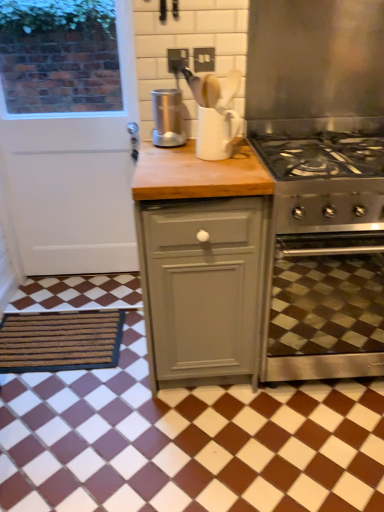
Question: Is brown textured mat at lower left smaller than white matte door at left?

Choices:
 (A) no
 (B) yes

Answer: (B)

Question: Is brown textured mat at lower left next to white matte door at left?

Choices:
 (A) no
 (B) yes

Answer: (A)

Question: Is brown textured mat at lower left further to the viewer compared to white matte door at left?

Choices:
 (A) yes
 (B) no

Answer: (A)

Question: Would you say brown textured mat at lower left contains white matte door at left?

Choices:
 (A) yes
 (B) no

Answer: (B)

Question: Is brown textured mat at lower left positioned before white matte door at left?

Choices:
 (A) yes
 (B) no

Answer: (B)

Question: Is brown textured mat at lower left aimed at white matte door at left?

Choices:
 (A) yes
 (B) no

Answer: (B)

Question: Is brown textured mat at lower left directly adjacent to stainless steel oven at right?

Choices:
 (A) no
 (B) yes

Answer: (A)

Question: Would you say brown textured mat at lower left is outside stainless steel oven at right?

Choices:
 (A) yes
 (B) no

Answer: (A)

Question: Can you confirm if brown textured mat at lower left is positioned to the left of stainless steel oven at right?

Choices:
 (A) no
 (B) yes

Answer: (B)

Question: Does brown textured mat at lower left have a lesser width compared to stainless steel oven at right?

Choices:
 (A) yes
 (B) no

Answer: (A)

Question: Is brown textured mat at lower left further to camera compared to stainless steel oven at right?

Choices:
 (A) no
 (B) yes

Answer: (B)

Question: Considering the relative sizes of brown textured mat at lower left and stainless steel oven at right in the image provided, is brown textured mat at lower left bigger than stainless steel oven at right?

Choices:
 (A) yes
 (B) no

Answer: (B)

Question: Considering the relative sizes of stainless steel exhaust hood at upper right and white glossy mug at upper center in the image provided, is stainless steel exhaust hood at upper right wider than white glossy mug at upper center?

Choices:
 (A) no
 (B) yes

Answer: (B)